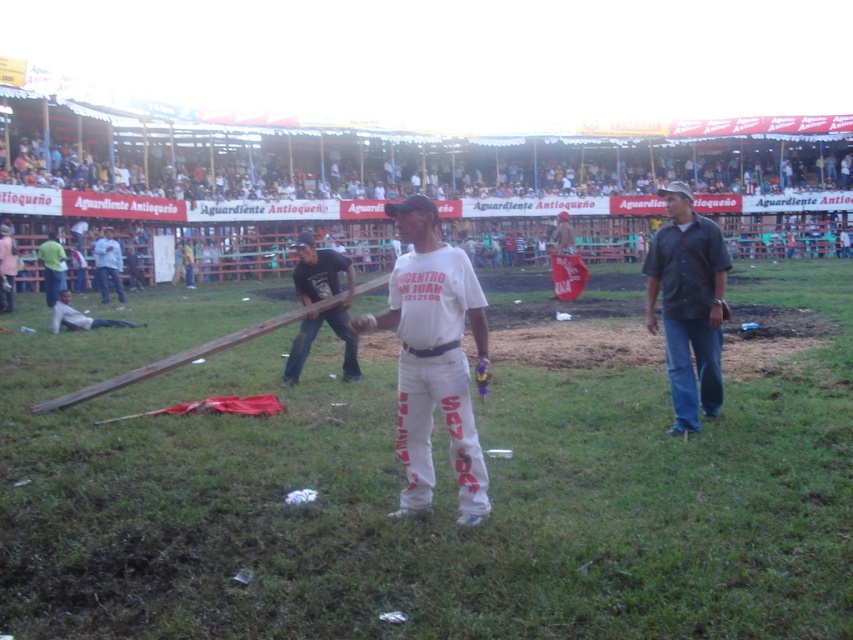
Is dark blue jeans at center bigger than light gray cotton shirt at center?

Correct, dark blue jeans at center is larger in size than light gray cotton shirt at center.

Which is above, dark blue jeans at center or light gray cotton shirt at center?

light gray cotton shirt at center is above.

Does point (308, 253) lie behind point (96, 253)?

No, it is in front of (96, 253).

This screenshot has height=640, width=853. I want to click on dark blue jeans at center, so click(x=318, y=300).

This screenshot has height=640, width=853. Find the location of `wooden pole at center`. wooden pole at center is located at coordinates (433, 497).

Is wooden pole at center shorter than light gray cotton shirt at center?

In fact, wooden pole at center may be taller than light gray cotton shirt at center.

Who is more distant from viewer, (96, 412) or (114, 269)?

The point (114, 269) is behind.

Where is `wooden pole at center`? The image size is (853, 640). wooden pole at center is located at coordinates (433, 497).

Who is lower down, white cotton shirt at center or dark blue shirt at right?

white cotton shirt at center

Does point (422, 228) lie in front of point (666, 372)?

Yes, point (422, 228) is closer to viewer.

Between point (421, 326) and point (693, 426), which one is positioned in front?

Positioned in front is point (421, 326).

This screenshot has height=640, width=853. Identify the location of white cotton shirt at center. (433, 358).